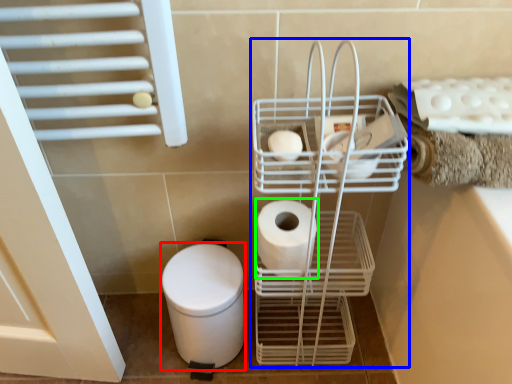
Question: Which is nearer to the bidet (highlighted by a red box)? trolley (highlighted by a blue box) or toilet paper (highlighted by a green box).

Choices:
 (A) trolley
 (B) toilet paper

Answer: (B)